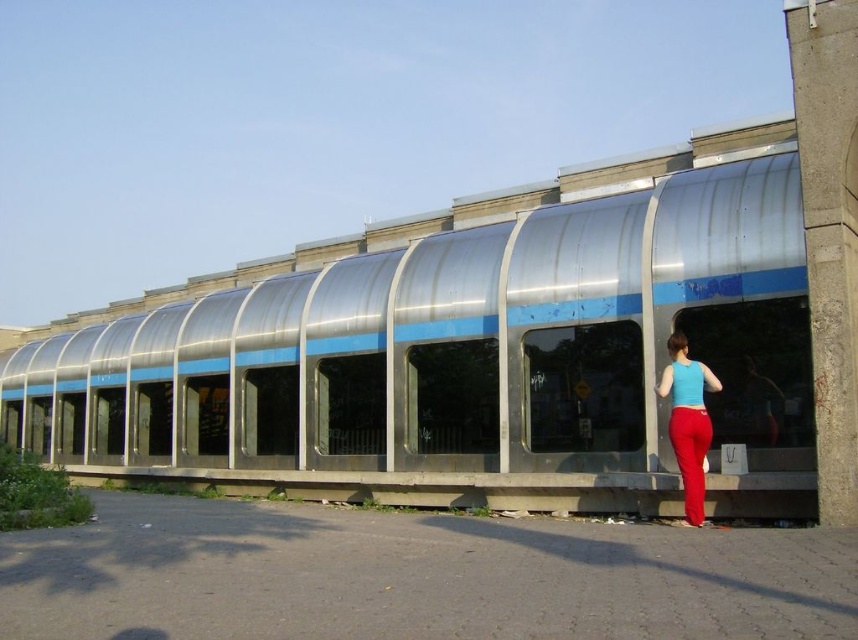
Question: Which point is farther to the camera?

Choices:
 (A) (675, 452)
 (B) (73, 392)

Answer: (B)

Question: Is metallic silver train at center smaller than matte blue tank top at center?

Choices:
 (A) no
 (B) yes

Answer: (A)

Question: Is metallic silver train at center behind matte blue tank top at center?

Choices:
 (A) yes
 (B) no

Answer: (A)

Question: Which point is closer to the camera?

Choices:
 (A) metallic silver train at center
 (B) matte blue tank top at center

Answer: (B)

Question: Can you confirm if metallic silver train at center is wider than matte blue tank top at center?

Choices:
 (A) no
 (B) yes

Answer: (B)